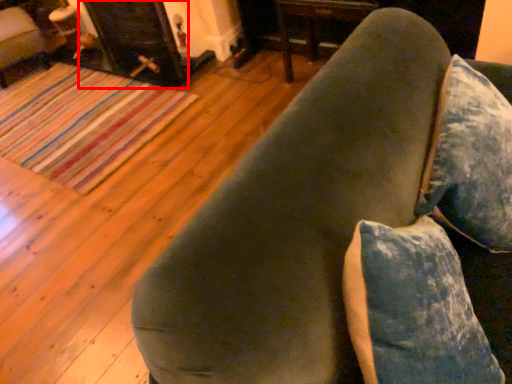
Question: Where is fireplace (annotated by the red box) located in relation to furniture in the image?

Choices:
 (A) right
 (B) left

Answer: (B)